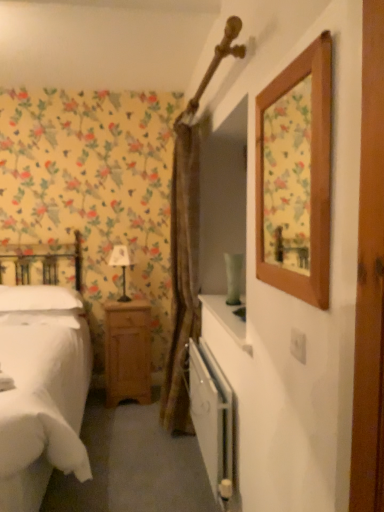
Question: Can you confirm if white fabric-covered table lamp at center-left is wider than light brown wood nightstand at lower left?

Choices:
 (A) yes
 (B) no

Answer: (B)

Question: From a real-world perspective, is white fabric-covered table lamp at center-left located higher than light brown wood nightstand at lower left?

Choices:
 (A) no
 (B) yes

Answer: (B)

Question: From the image's perspective, would you say white fabric-covered table lamp at center-left is shown under light brown wood nightstand at lower left?

Choices:
 (A) no
 (B) yes

Answer: (A)

Question: Does white fabric-covered table lamp at center-left have a smaller size compared to light brown wood nightstand at lower left?

Choices:
 (A) yes
 (B) no

Answer: (A)

Question: Considering the relative positions of white fabric-covered table lamp at center-left and light brown wood nightstand at lower left in the image provided, is white fabric-covered table lamp at center-left to the left of light brown wood nightstand at lower left from the viewer's perspective?

Choices:
 (A) no
 (B) yes

Answer: (B)

Question: From a real-world perspective, is white fabric-covered table lamp at center-left physically below light brown wood nightstand at lower left?

Choices:
 (A) no
 (B) yes

Answer: (A)

Question: Is white soft pillow at left bigger than white metallic radiator at lower center?

Choices:
 (A) no
 (B) yes

Answer: (B)

Question: From a real-world perspective, is white soft pillow at left located beneath white metallic radiator at lower center?

Choices:
 (A) no
 (B) yes

Answer: (A)

Question: Can you confirm if white soft pillow at left is positioned to the right of white metallic radiator at lower center?

Choices:
 (A) no
 (B) yes

Answer: (A)

Question: Is the depth of white soft pillow at left greater than that of white metallic radiator at lower center?

Choices:
 (A) no
 (B) yes

Answer: (B)

Question: Is white soft pillow at left positioned with its back to white metallic radiator at lower center?

Choices:
 (A) no
 (B) yes

Answer: (A)

Question: Could white metallic radiator at lower center be considered to be inside white soft pillow at left?

Choices:
 (A) no
 (B) yes

Answer: (A)

Question: Does brown textured curtain at center have a greater height compared to white metallic radiator at lower center?

Choices:
 (A) yes
 (B) no

Answer: (A)